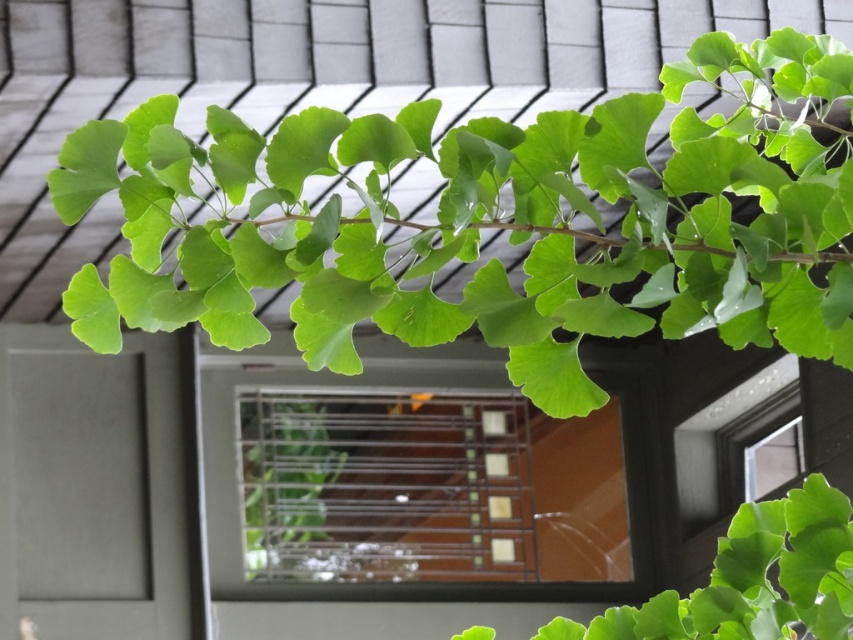
You are a painter standing in front of the scene described. You want to paint the green matte leafy branch at upper center first. Based on the scene description, where exactly should you position your canvas relative to the building roof to capture the branch properly?

The green matte leafy branch at upper center is located at point (492,221), so you should position your canvas slightly to the right and above the building roof to capture the branch accurately.

You are a painter standing in front of the clear glass window at center and the green matte leaf at center. You want to paint the object that is more to the right. Which one should you choose?

The green matte leaf at center is more to the right because the clear glass window at center is positioned on the left side of it.